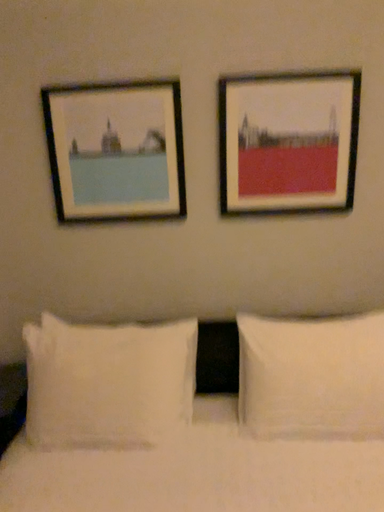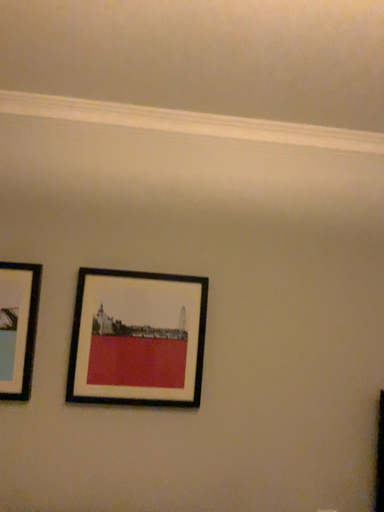
Question: How did the camera likely rotate when shooting the video?

Choices:
 (A) rotated left
 (B) rotated right

Answer: (B)